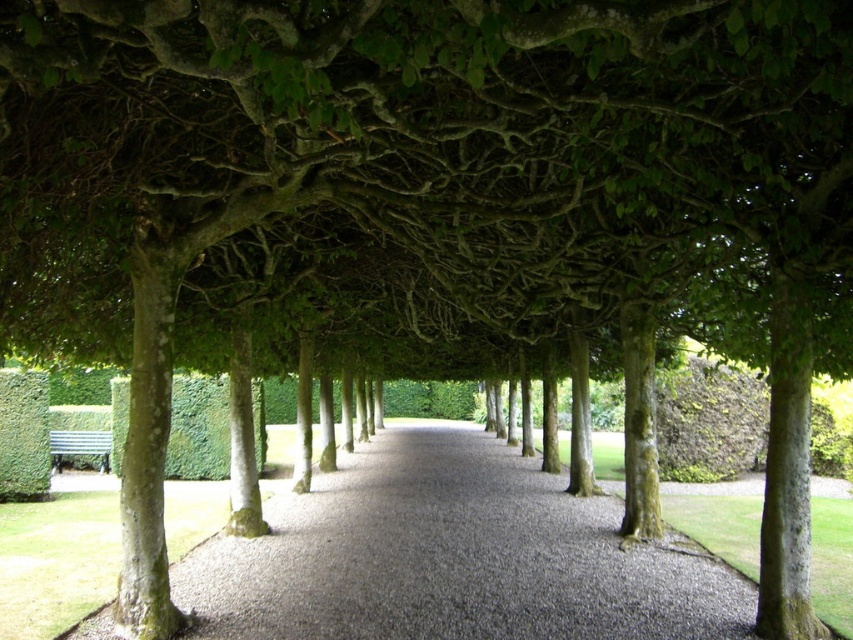
Question: Considering the relative positions of smooth gravel path at center and metallic silver bench at lower left in the image provided, where is smooth gravel path at center located with respect to metallic silver bench at lower left?

Choices:
 (A) right
 (B) left

Answer: (A)

Question: Can you confirm if smooth gravel path at center is thinner than metallic silver bench at lower left?

Choices:
 (A) no
 (B) yes

Answer: (A)

Question: Which of the following is the farthest from the observer?

Choices:
 (A) (90, 448)
 (B) (496, 570)

Answer: (A)

Question: Does smooth gravel path at center appear over metallic silver bench at lower left?

Choices:
 (A) no
 (B) yes

Answer: (A)